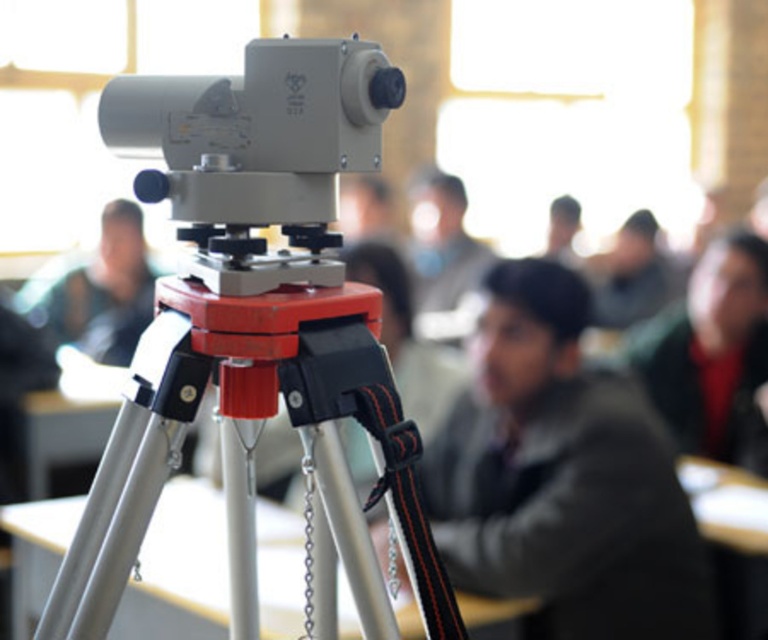
Question: Considering the real-world distances, which object is closest to the matte black camera at center?

Choices:
 (A) metallic tripod at center
 (B) dark gray jacket at center

Answer: (B)

Question: Among these points, which one is farthest from the camera?

Choices:
 (A) (560, 324)
 (B) (167, 326)
 (C) (121, 352)

Answer: (C)

Question: Is metallic tripod at center closer to camera compared to matte black camera at center?

Choices:
 (A) no
 (B) yes

Answer: (B)

Question: Can you confirm if dark gray jacket at center is positioned below matte black camera at center?

Choices:
 (A) yes
 (B) no

Answer: (A)

Question: Which point appears closest to the camera in this image?

Choices:
 (A) (485, 326)
 (B) (78, 333)
 (C) (313, 624)

Answer: (C)

Question: Does metallic tripod at center appear on the right side of matte black camera at center?

Choices:
 (A) yes
 (B) no

Answer: (A)